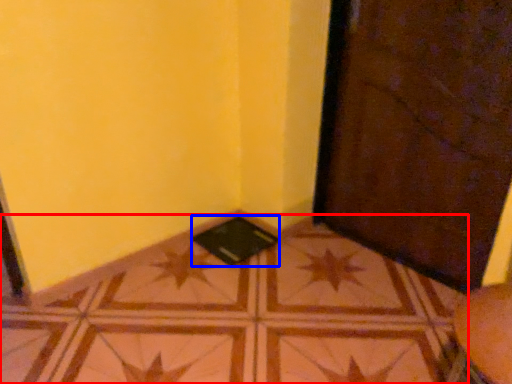
Question: Which point is closer to the camera, tile (highlighted by a red box) or pad (highlighted by a blue box)?

Choices:
 (A) tile
 (B) pad

Answer: (A)